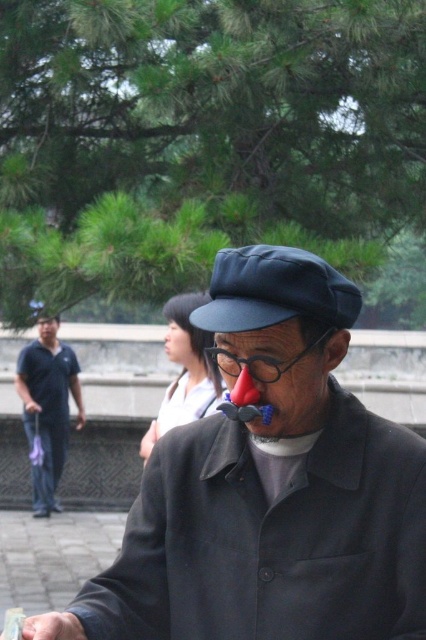
You are a fashion designer observing the scene. You need to determine which item of clothing is smaller in size between the black fabric cap at center and the matte blue jeans at left. Which one is smaller?

The black fabric cap at center has a smaller size compared to matte blue jeans at left, so the black fabric cap at center is the smaller one.

You are a photographer trying to capture a candid shot of the man in the dark gray matte jacket at center and the person in matte blue jeans at left. Since you want to frame both subjects in the same shot, which direction should you move to ensure both are visible in your camera viewfinder?

The dark gray matte jacket at center is positioned on the right side of matte blue jeans at left, so you should move to the left to include both subjects in your camera viewfinder.

You are a delivery drone operator. Your drone needs to deliver a package to the dark gray matte jacket at center, but there is an obstacle at matte blue jeans at left. What is the minimum distance your drone must fly to avoid the obstacle?

The minimum distance your drone must fly to avoid the obstacle is 8.70 meters, as that is the distance between the dark gray matte jacket at center and the matte blue jeans at left.